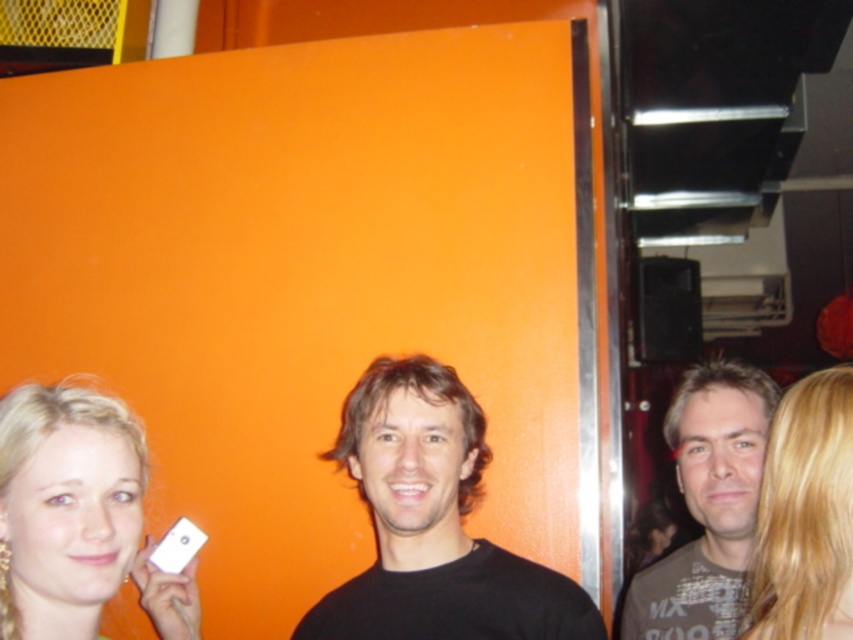
You are taking a photo of the scene and need to ensure the matte white phone at lower left is in focus. Based on its position, where should you aim the camera to capture it clearly?

The matte white phone at lower left is located at point (76, 515), so you should aim the camera at that coordinate to ensure it is in focus.